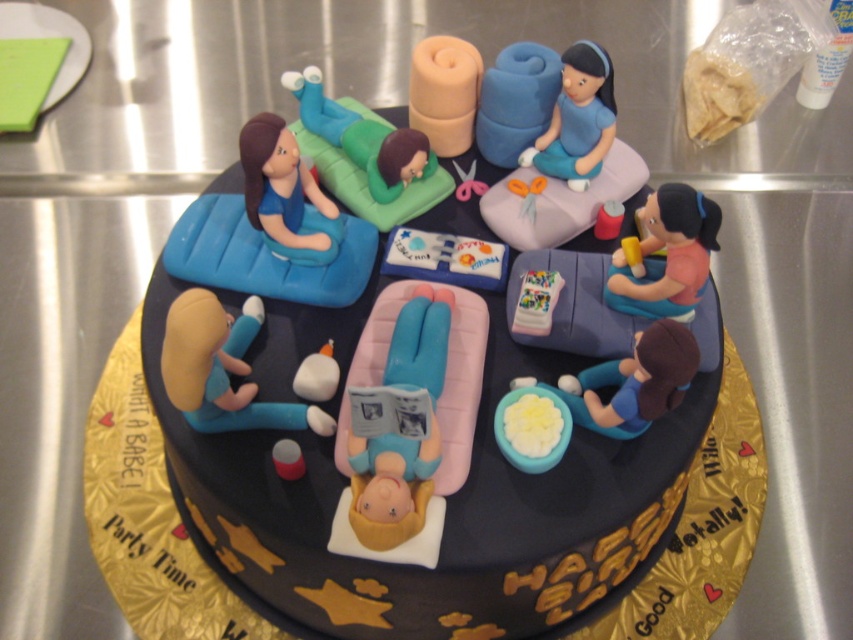
Question: Which object is closer to the camera taking this photo?

Choices:
 (A) matte blue foam at center
 (B) matte green fabric at upper center

Answer: (B)

Question: Based on their relative distances, which object is nearer to the matte pink fabric at center?

Choices:
 (A) blue glossy bowl at lower right
 (B) matte blue cake at center

Answer: (A)

Question: Is matte pink foam at center to the left of blue matte figure at upper right from the viewer's perspective?

Choices:
 (A) yes
 (B) no

Answer: (A)

Question: Does matte blue cake at center appear on the left side of matte pink foam at center?

Choices:
 (A) yes
 (B) no

Answer: (B)

Question: Which point is closer to the camera?

Choices:
 (A) (648, 273)
 (B) (358, 532)
 (C) (598, 84)

Answer: (B)

Question: Is matte green fabric at upper center to the right of matte blue foam at center from the viewer's perspective?

Choices:
 (A) yes
 (B) no

Answer: (B)